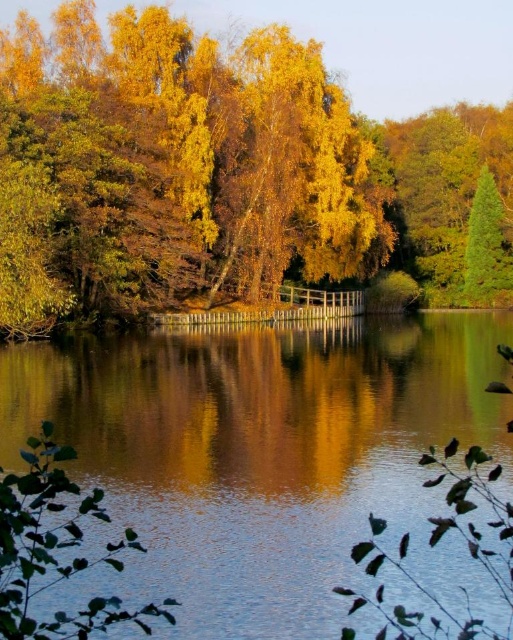
Who is positioned more to the left, yellow leafy tree at upper center or transparent water at center?

Positioned to the left is transparent water at center.

Is yellow leafy tree at upper center to the left of transparent water at center from the viewer's perspective?

Incorrect, yellow leafy tree at upper center is not on the left side of transparent water at center.

The width and height of the screenshot is (513, 640). What are the coordinates of `yellow leafy tree at upper center` in the screenshot? It's located at (213, 170).